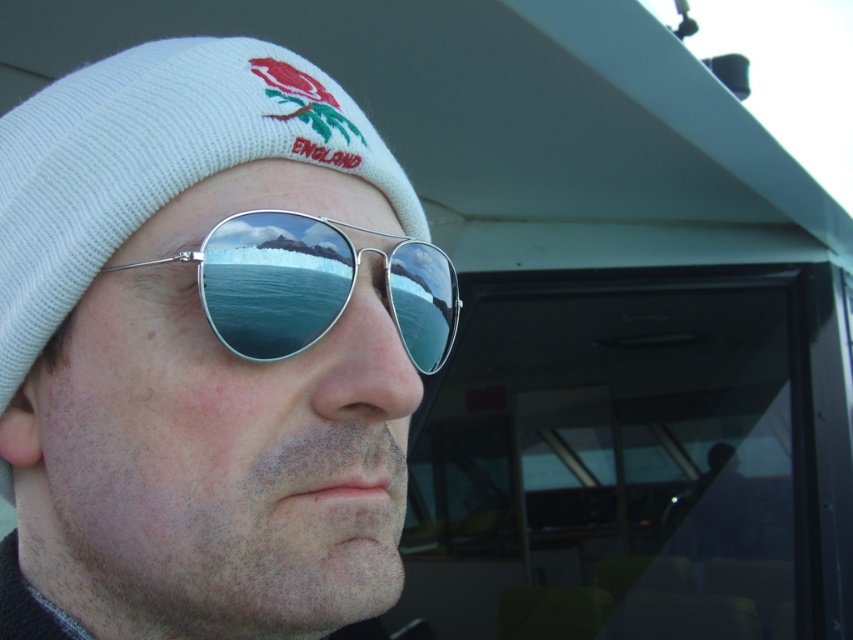
You are a photographer trying to capture the reflection in the silver reflective aviator sunglasses at center. However, the white knit beanie at upper left is blocking your view. Can you adjust your position to see the reflection without moving the sunglasses?

The white knit beanie at upper left is in front of the silver reflective aviator sunglasses at center, so moving your position slightly to the side or angle might allow you to see the reflection by positioning yourself behind the beanie.

You are designing a virtual reality headset that must fit between the white knit beanie at upper left and the silver reflective aviator sunglasses at center. The headset requires a minimum of 2 inches of space to function properly. Based on the scene, will the available space between these two items be sufficient?

The white knit beanie at upper left and the silver reflective aviator sunglasses at center are 1.97 inches apart, which is less than the required 2 inches. Therefore, the virtual reality headset will not have enough space to function properly between them.

You are a photographer trying to capture the reflection in the silver reflective aviator sunglasses at center. To ensure the white knit beanie at upper left doesn not block the view of the mountainous landscape in the reflection, should you adjust your position to the left or right?

The white knit beanie at upper left might be wider than silver reflective aviator sunglasses at center, so adjusting your position to the right could help avoid blocking the mountain view in the reflection.